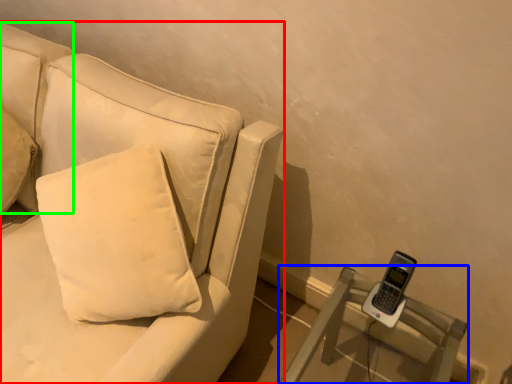
Question: Which object is positioned farthest from studio couch (highlighted by a red box)? Select from furniture (highlighted by a blue box) and pillow (highlighted by a green box).

Choices:
 (A) furniture
 (B) pillow

Answer: (A)